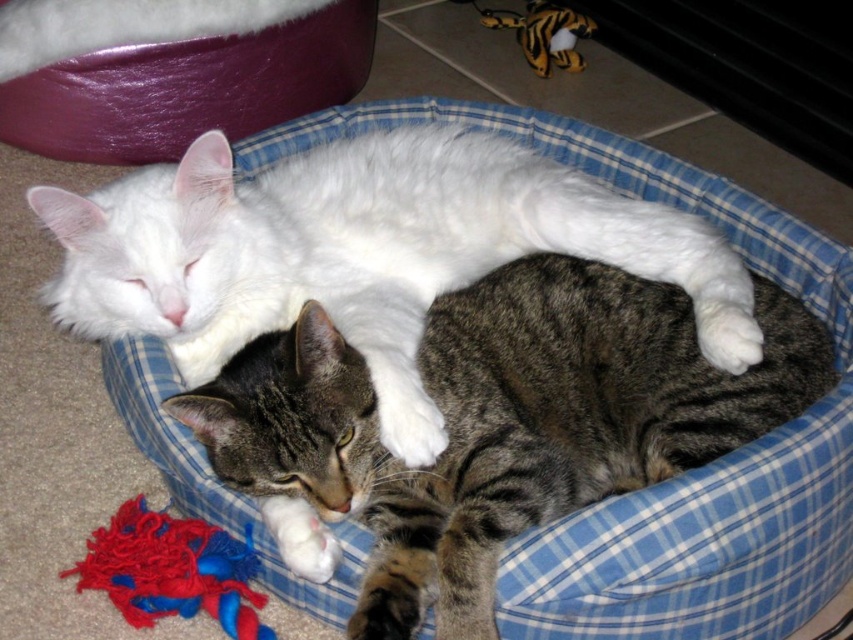
Which is behind, point (659, 317) or point (154, 566)?

The point (659, 317) is more distant.

Does tabby fur cat at center have a larger size compared to yarn fabric toy at lower left?

Yes.

Identify the location of tabby fur cat at center. This screenshot has width=853, height=640. (498, 420).

Locate an element on the screen. Image resolution: width=853 pixels, height=640 pixels. tabby fur cat at center is located at coordinates (498, 420).

Can you confirm if tabby fur cat at center is positioned below white fluffy cat at center?

Yes, tabby fur cat at center is below white fluffy cat at center.

Based on the photo, is tabby fur cat at center wider than white fluffy cat at center?

No.

Is point (444, 506) positioned after point (395, 220)?

No, (444, 506) is in front of (395, 220).

This screenshot has width=853, height=640. I want to click on tabby fur cat at center, so click(498, 420).

In the scene shown: Can you confirm if white fluffy cat at center is bigger than yarn fabric toy at lower left?

Yes.

The image size is (853, 640). What are the coordinates of `white fluffy cat at center` in the screenshot? It's located at (360, 252).

The image size is (853, 640). What do you see at coordinates (360, 252) in the screenshot?
I see `white fluffy cat at center` at bounding box center [360, 252].

This screenshot has height=640, width=853. Identify the location of white fluffy cat at center. (360, 252).